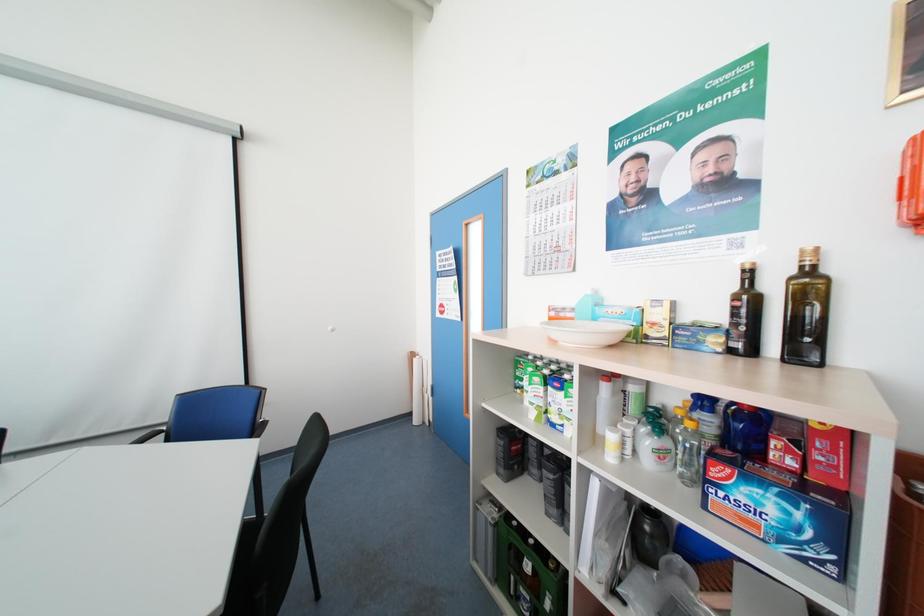
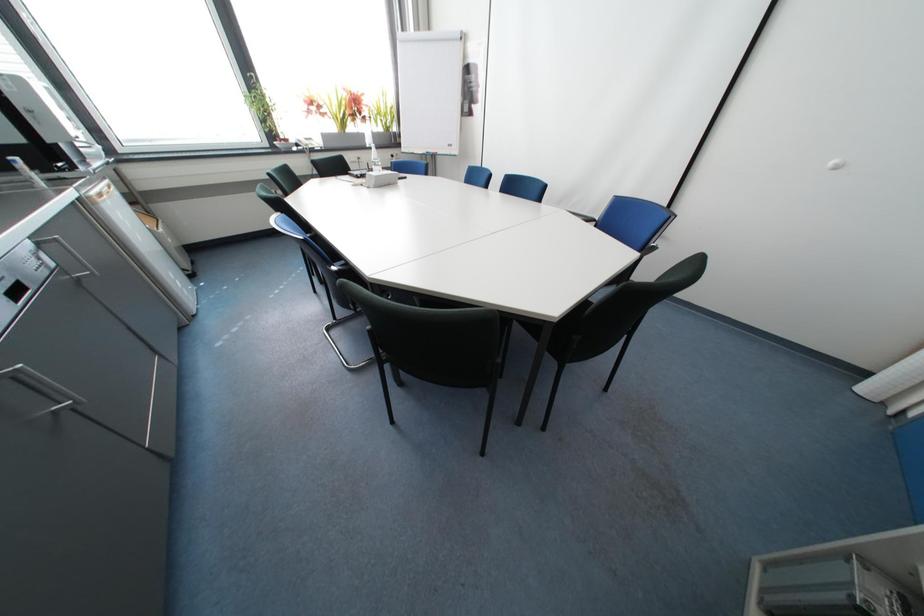
Looking at this image, the images are taken continuously from a first-person perspective. In which direction is your viewpoint rotating?

The rotation direction of the camera is left-down.